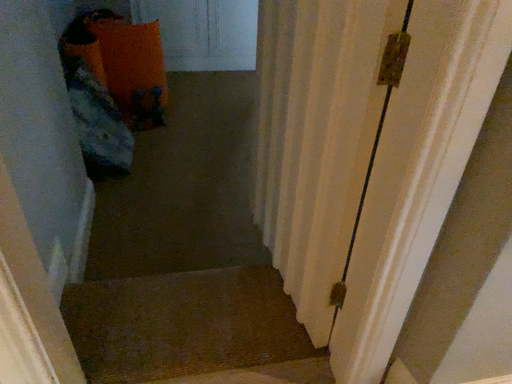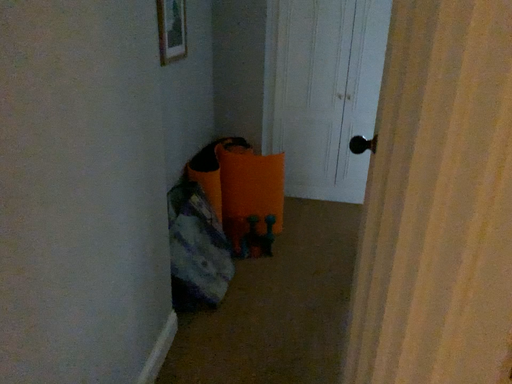
Question: How did the camera likely rotate when shooting the video?

Choices:
 (A) rotated right
 (B) rotated left

Answer: (B)